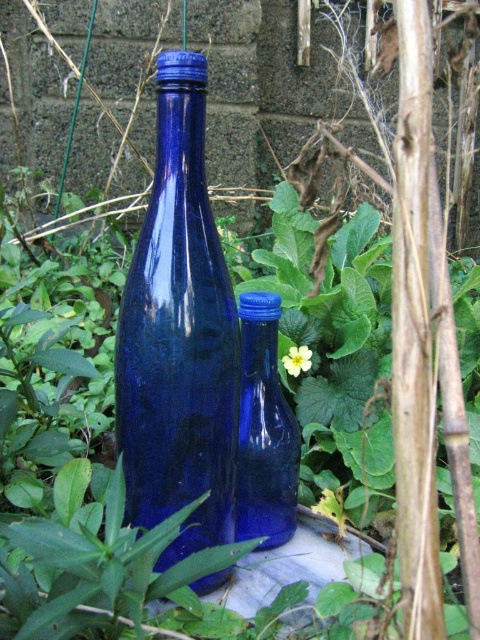
Question: Which of the following is the farthest from the observer?

Choices:
 (A) blue glass bottle at center
 (B) yellow matte flower at center

Answer: (B)

Question: Is blue glass bottle at center thinner than yellow matte flower at center?

Choices:
 (A) yes
 (B) no

Answer: (B)

Question: Among these points, which one is nearest to the camera?

Choices:
 (A) (294, 371)
 (B) (268, 460)
 (C) (159, 467)

Answer: (C)

Question: Does cobalt blue glass bottle at center have a lesser width compared to blue glass bottle at center?

Choices:
 (A) no
 (B) yes

Answer: (A)

Question: Is cobalt blue glass bottle at center to the left of yellow matte flower at center from the viewer's perspective?

Choices:
 (A) no
 (B) yes

Answer: (B)

Question: Which object is positioned closest to the cobalt blue glass bottle at center?

Choices:
 (A) yellow matte flower at center
 (B) blue glass bottle at center

Answer: (B)